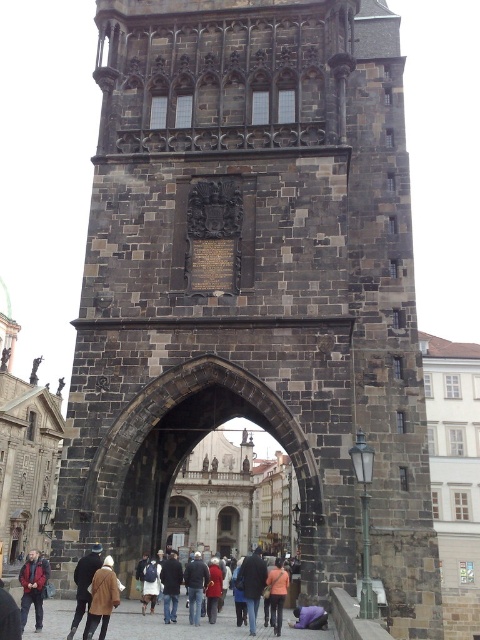
Looking at this image, you are standing in front of the historic stone archway and want to take a photo. There are two points marked in the image at coordinates point (197, 586) and point (302, 609). Which point is closer to your camera lens when taking the photo?

Point (197, 586) is further to the camera than point (302, 609), so the point closer to the camera lens is point (302, 609).

You are a tour guide standing at the base of the historic stone archway. You notice two visitors wearing an orange fabric jacket at lower center and a purple fabric at lower center. If you want to approach both visitors to provide information, which visitor is closer to you?

The orange fabric jacket at lower center and purple fabric at lower center are 5.42 feet apart, but the question does not specify their exact positions relative to the tour guide. Without additional information about their direction from you, it is impossible to determine which is closer.